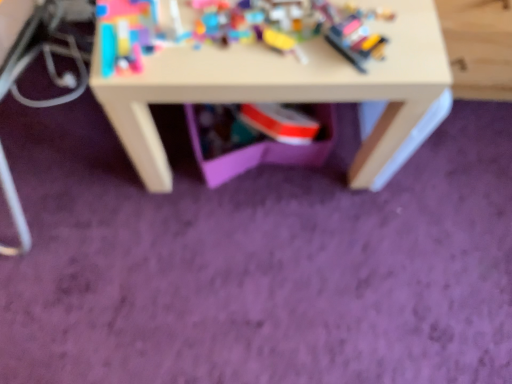
Locate an element on the screen. matte white table at center is located at coordinates (284, 86).

The image size is (512, 384). What do you see at coordinates (284, 86) in the screenshot? I see `matte white table at center` at bounding box center [284, 86].

Measure the distance between matte white table at center and camera.

matte white table at center is 66.18 centimeters from camera.

What is the approximate width of plastic building blocks at upper center?

plastic building blocks at upper center is 7.59 inches in width.

Find the location of a particular element. The height and width of the screenshot is (384, 512). plastic building blocks at upper center is located at coordinates (229, 28).

This screenshot has width=512, height=384. Describe the element at coordinates (229, 28) in the screenshot. I see `plastic building blocks at upper center` at that location.

Where is `matte white table at center`? The height and width of the screenshot is (384, 512). matte white table at center is located at coordinates (284, 86).

Which is more to the right, matte white table at center or plastic building blocks at upper center?

Positioned to the right is matte white table at center.

From the picture: In the image, is matte white table at center positioned in front of or behind plastic building blocks at upper center?

Visually, matte white table at center is located behind plastic building blocks at upper center.

Which is farther, [136,161] or [277,7]?

The point [136,161] is farther from the camera.

From the image's perspective, is matte white table at center positioned above or below plastic building blocks at upper center?

From the image's perspective, matte white table at center appears above plastic building blocks at upper center.

From a real-world perspective, who is located higher, matte white table at center or plastic building blocks at upper center?

plastic building blocks at upper center is physically above.

Based on the photo, does matte white table at center have a lesser width compared to plastic building blocks at upper center?

No.

From their relative heights in the image, would you say matte white table at center is taller or shorter than plastic building blocks at upper center?

Considering their sizes, matte white table at center has more height than plastic building blocks at upper center.

Between matte white table at center and plastic building blocks at upper center, which one has smaller size?

Smaller between the two is plastic building blocks at upper center.

Choose the correct answer: Is matte white table at center inside plastic building blocks at upper center or outside it?

matte white table at center lies outside plastic building blocks at upper center.

Is matte white table at center not close to plastic building blocks at upper center?

No.

Is matte white table at center facing away from plastic building blocks at upper center?

No, matte white table at center's orientation is not away from plastic building blocks at upper center.

In order to click on toy above the matte white table at center (from a real-world perspective) in this screenshot , I will do `click(229, 28)`.

Considering the positions of objects plastic building blocks at upper center and matte white table at center in the image provided, who is more to the left, plastic building blocks at upper center or matte white table at center?

plastic building blocks at upper center is more to the left.

Which is behind, plastic building blocks at upper center or matte white table at center?

matte white table at center is further from the camera.

Which is less distant, (140, 18) or (402, 97)?

Point (140, 18) appears to be closer to the viewer than point (402, 97).

From the image's perspective, is plastic building blocks at upper center positioned above or below matte white table at center?

From the image's perspective, plastic building blocks at upper center appears below matte white table at center.

From a real-world perspective, is plastic building blocks at upper center under matte white table at center?

No, from a real-world perspective, plastic building blocks at upper center is not below matte white table at center.

Is plastic building blocks at upper center thinner than matte white table at center?

Yes.

Considering the sizes of plastic building blocks at upper center and matte white table at center in the image, is plastic building blocks at upper center taller or shorter than matte white table at center?

plastic building blocks at upper center is shorter than matte white table at center.

Considering the sizes of objects plastic building blocks at upper center and matte white table at center in the image provided, who is bigger, plastic building blocks at upper center or matte white table at center?

With larger size is matte white table at center.

Is plastic building blocks at upper center not within matte white table at center?

That's correct, plastic building blocks at upper center is outside of matte white table at center.

Is plastic building blocks at upper center next to matte white table at center and touching it?

Yes, plastic building blocks at upper center is next to matte white table at center.

Is plastic building blocks at upper center oriented away from matte white table at center?

That's not correct — plastic building blocks at upper center is not looking away from matte white table at center.

How different are the orientations of plastic building blocks at upper center and matte white table at center in degrees?

4.12 degrees.

Identify the location of toy in front of the matte white table at center. (229, 28).

At what (x,y) coordinates should I click in order to perform the action: click on toy on the left of matte white table at center. Please return your answer as a coordinate pair (x, y). Looking at the image, I should click on (229, 28).

Find the location of `toy that is in front of the matte white table at center`. toy that is in front of the matte white table at center is located at coordinates (229, 28).